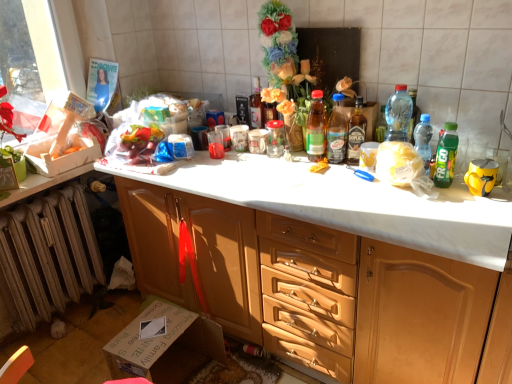
Find the location of a particular element. This screenshot has height=384, width=512. vacant space positioned to the left of green plastic bottle at right, which ranks as the 1th bottle in right-to-left order is located at coordinates (399, 195).